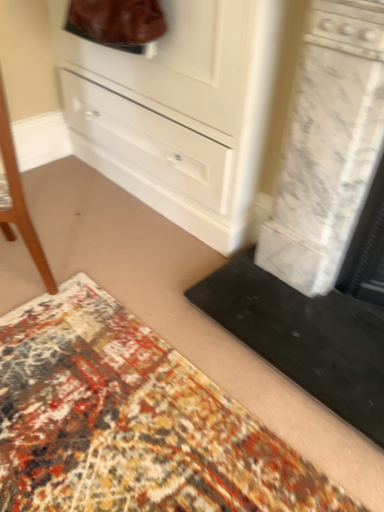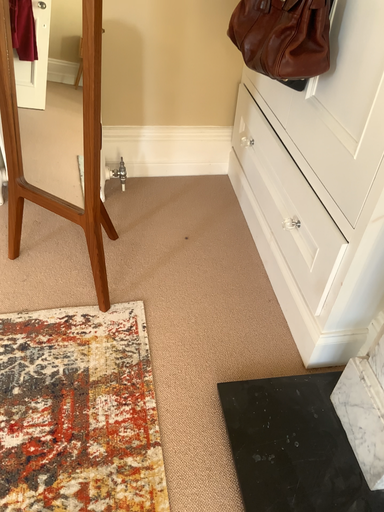
Question: How did the camera likely rotate when shooting the video?

Choices:
 (A) rotated upward
 (B) rotated downward

Answer: (A)